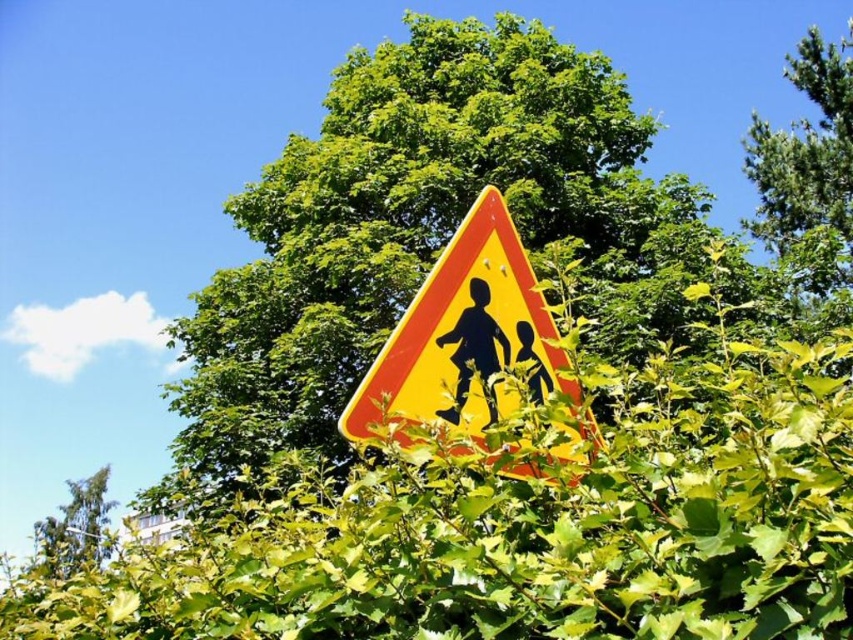
Who is more distant from viewer, (682,605) or (502,156)?

The point (502,156) is behind.

Looking at this image, does green leafy hedge at center appear on the left side of green leafy tree at center?

No, green leafy hedge at center is not to the left of green leafy tree at center.

I want to click on green leafy hedge at center, so click(531, 524).

Where is `green leafy hedge at center`? green leafy hedge at center is located at coordinates (531, 524).

Is yellow reflective triangle at center wider than green leafy tree at upper right?

In fact, yellow reflective triangle at center might be narrower than green leafy tree at upper right.

Who is shorter, yellow reflective triangle at center or green leafy tree at upper right?

yellow reflective triangle at center

The image size is (853, 640). In order to click on yellow reflective triangle at center in this screenshot , I will do `click(461, 336)`.

Can you confirm if green leafy hedge at center is thinner than yellow reflective triangle at center?

No.

Which of these two, green leafy hedge at center or yellow reflective triangle at center, stands taller?

With more height is green leafy hedge at center.

The height and width of the screenshot is (640, 853). I want to click on green leafy hedge at center, so click(x=531, y=524).